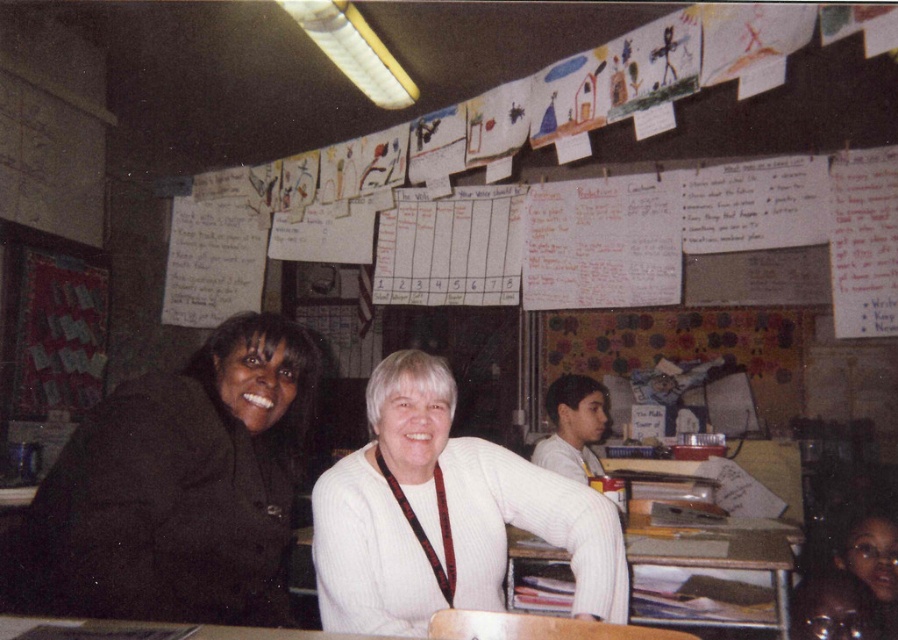
You are a student in the classroom and want to hand in an assignment to the teacher. You notice the black matte jacket at left and the white ribbed sweater at center. Which clothing item is positioned higher up on the person wearing it?

The black matte jacket at left is located above the white ribbed sweater at center, so the black matte jacket at left is positioned higher up on the person wearing it.

You are a photographer standing in a classroom and need to take a photo of the black matte jacket at left. The camera you are holding is 4.29 feet away from the jacket. Is the distance sufficient to capture the jacket clearly in the photo?

The black matte jacket at left and camera are 4.29 feet apart, so the distance is sufficient to capture the jacket clearly in the photo.

You are a student who needs to place a textbook on the white ribbed sweater at center and the wooden table at center. Which object can accommodate a larger textbook?

The wooden table at center can accommodate a larger textbook since it has a bigger size compared to the white ribbed sweater at center.